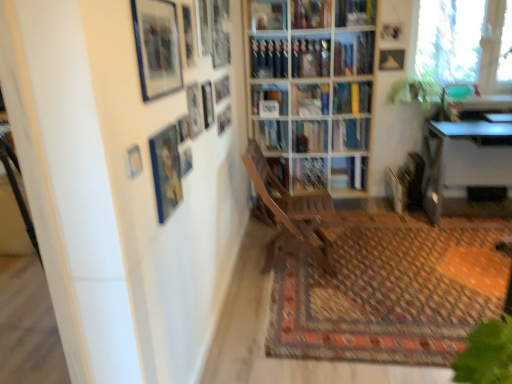
Question: Relative to metallic silver picture frame at upper center, positioned as the ninth picture frame in front-to-back order, is matte black picture frame at upper center, arranged as the fifth picture frame when viewed from the back, in front or behind?

Choices:
 (A) behind
 (B) front

Answer: (B)

Question: Is matte black picture frame at upper center, the 7th picture frame in the front-to-back sequence, inside or outside of metallic silver picture frame at upper center, which appears as the third picture frame when viewed from the back?

Choices:
 (A) inside
 (B) outside

Answer: (B)

Question: Which object is positioned farthest from the wooden bookcase at center?

Choices:
 (A) blue glossy picture frame at upper left, which appears as the tenth picture frame when viewed from the back
 (B) metallic silver picture frame at upper left, which appears as the 11th picture frame when viewed from the right
 (C) matte black picture frame at upper center, positioned as the seventh picture frame in right-to-left order
 (D) hardcover book at upper center, the 4th book in the bottom-to-top sequence
 (E) metallic silver desk at right

Answer: (B)

Question: Which object is the closest to the green leafy plant at upper right?

Choices:
 (A) matte black picture frame at upper center, arranged as the 2th picture frame when viewed from the right
 (B) patterned carpet at center
 (C) matte black picture frame at upper center, positioned as the seventh picture frame in right-to-left order
 (D) matte black picture frame at upper center, positioned as the 8th picture frame in back-to-front order
 (E) hardcover book at upper center, positioned as the 3th book in bottom-to-top order

Answer: (E)